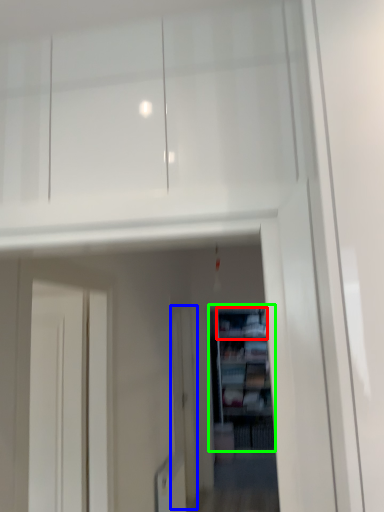
Question: Which object is positioned closest to cabinet (highlighted by a red box)? Select from screen door (highlighted by a blue box) and shelf (highlighted by a green box).

Choices:
 (A) screen door
 (B) shelf

Answer: (B)